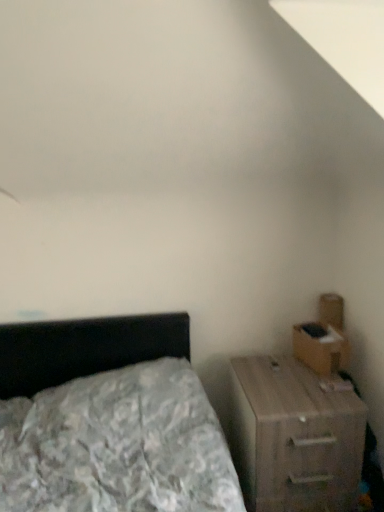
Question: Can you confirm if wooden nightstand at right is positioned to the right of brown cardboard drawer at right?

Choices:
 (A) no
 (B) yes

Answer: (A)

Question: Can brown cardboard drawer at right be found inside wooden nightstand at right?

Choices:
 (A) no
 (B) yes

Answer: (A)

Question: Is wooden nightstand at right facing towards brown cardboard drawer at right?

Choices:
 (A) yes
 (B) no

Answer: (B)

Question: From the image's perspective, does wooden nightstand at right appear higher than brown cardboard drawer at right?

Choices:
 (A) no
 (B) yes

Answer: (A)

Question: From the image's perspective, does wooden nightstand at right appear lower than brown cardboard drawer at right?

Choices:
 (A) no
 (B) yes

Answer: (B)

Question: Is wooden nightstand at right thinner than brown cardboard drawer at right?

Choices:
 (A) no
 (B) yes

Answer: (A)

Question: Is brown cardboard drawer at right smaller than wooden nightstand at right?

Choices:
 (A) no
 (B) yes

Answer: (B)

Question: Would you say brown cardboard drawer at right is outside wooden nightstand at right?

Choices:
 (A) yes
 (B) no

Answer: (A)

Question: Is brown cardboard drawer at right at the right side of wooden nightstand at right?

Choices:
 (A) no
 (B) yes

Answer: (B)

Question: From a real-world perspective, is brown cardboard drawer at right over wooden nightstand at right?

Choices:
 (A) no
 (B) yes

Answer: (B)

Question: From a real-world perspective, is brown cardboard drawer at right below wooden nightstand at right?

Choices:
 (A) no
 (B) yes

Answer: (A)

Question: Is brown cardboard drawer at right oriented towards wooden nightstand at right?

Choices:
 (A) no
 (B) yes

Answer: (A)

Question: Looking at their shapes, would you say brown cardboard drawer at right is wider or thinner than wooden nightstand at right?

Choices:
 (A) thin
 (B) wide

Answer: (A)